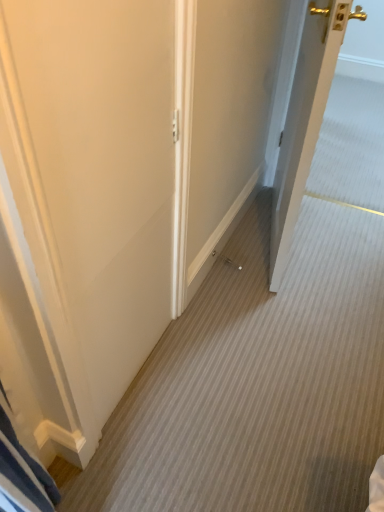
Find the location of a particular element. This screenshot has height=512, width=384. white matte door at center, marked as the second door in a right-to-left arrangement is located at coordinates (84, 204).

The image size is (384, 512). Describe the element at coordinates (84, 204) in the screenshot. I see `white matte door at center, the 1th door when ordered from left to right` at that location.

The width and height of the screenshot is (384, 512). I want to click on white wood door at right, placed as the 2th door when sorted from left to right, so (x=305, y=120).

Describe the element at coordinates (305, 120) in the screenshot. The image size is (384, 512). I see `white wood door at right, placed as the 2th door when sorted from left to right` at that location.

This screenshot has height=512, width=384. Identify the location of white matte door at center, marked as the second door in a right-to-left arrangement. (84, 204).

Can you confirm if white matte door at center, the 1th door when ordered from left to right, is positioned to the right of white wood door at right, placed as the 2th door when sorted from left to right?

No, white matte door at center, the 1th door when ordered from left to right, is not to the right of white wood door at right, placed as the 2th door when sorted from left to right.

Between white matte door at center, the 1th door when ordered from left to right, and white wood door at right, the first door positioned from the right, which one is positioned in front?

white matte door at center, the 1th door when ordered from left to right, is more forward.

Does point (123, 273) appear closer or farther from the camera than point (318, 65)?

Point (123, 273) is closer to the camera than point (318, 65).

From the image's perspective, is white matte door at center, marked as the second door in a right-to-left arrangement, beneath white wood door at right, the first door positioned from the right?

Correct, white matte door at center, marked as the second door in a right-to-left arrangement, appears lower than white wood door at right, the first door positioned from the right, in the image.

From a real-world perspective, is white matte door at center, marked as the second door in a right-to-left arrangement, on top of white wood door at right, the first door positioned from the right?

Indeed, from a real-world perspective, white matte door at center, marked as the second door in a right-to-left arrangement, stands above white wood door at right, the first door positioned from the right.

Consider the image. Is white matte door at center, the 1th door when ordered from left to right, wider than white wood door at right, placed as the 2th door when sorted from left to right?

No.

In the scene shown: Can you confirm if white matte door at center, the 1th door when ordered from left to right, is shorter than white wood door at right, the first door positioned from the right?

In fact, white matte door at center, the 1th door when ordered from left to right, may be taller than white wood door at right, the first door positioned from the right.

Which of these two, white matte door at center, marked as the second door in a right-to-left arrangement, or white wood door at right, the first door positioned from the right, is bigger?

white wood door at right, the first door positioned from the right.

Is white matte door at center, marked as the second door in a right-to-left arrangement, not inside white wood door at right, placed as the 2th door when sorted from left to right?

Yes, white matte door at center, marked as the second door in a right-to-left arrangement, is not within white wood door at right, placed as the 2th door when sorted from left to right.

From the picture: Is white matte door at center, the 1th door when ordered from left to right, positioned with its back to white wood door at right, the first door positioned from the right?

No, white matte door at center, the 1th door when ordered from left to right, is not facing the opposite direction of white wood door at right, the first door positioned from the right.

Where is `door behind the white matte door at center, marked as the second door in a right-to-left arrangement`? door behind the white matte door at center, marked as the second door in a right-to-left arrangement is located at coordinates (305, 120).

Between white wood door at right, the first door positioned from the right, and white matte door at center, marked as the second door in a right-to-left arrangement, which one appears on the right side from the viewer's perspective?

white wood door at right, the first door positioned from the right.

Considering the relative positions of white wood door at right, placed as the 2th door when sorted from left to right, and white matte door at center, marked as the second door in a right-to-left arrangement, in the image provided, is white wood door at right, placed as the 2th door when sorted from left to right, in front of white matte door at center, marked as the second door in a right-to-left arrangement,?

No, it is not.

Which is more distant, (331,6) or (11,379)?

Positioned behind is point (331,6).

From the image's perspective, does white wood door at right, placed as the 2th door when sorted from left to right, appear lower than white matte door at center, the 1th door when ordered from left to right?

No, from the image's perspective, white wood door at right, placed as the 2th door when sorted from left to right, is not beneath white matte door at center, the 1th door when ordered from left to right.

From a real-world perspective, is white wood door at right, placed as the 2th door when sorted from left to right, located higher than white matte door at center, the 1th door when ordered from left to right?

No.

Which of these two, white wood door at right, the first door positioned from the right, or white matte door at center, the 1th door when ordered from left to right, is wider?

With larger width is white wood door at right, the first door positioned from the right.

Considering the relative sizes of white wood door at right, placed as the 2th door when sorted from left to right, and white matte door at center, the 1th door when ordered from left to right, in the image provided, is white wood door at right, placed as the 2th door when sorted from left to right, taller than white matte door at center, the 1th door when ordered from left to right,?

Incorrect, the height of white wood door at right, placed as the 2th door when sorted from left to right, is not larger of that of white matte door at center, the 1th door when ordered from left to right.

Considering the sizes of objects white wood door at right, the first door positioned from the right, and white matte door at center, the 1th door when ordered from left to right, in the image provided, who is bigger, white wood door at right, the first door positioned from the right, or white matte door at center, the 1th door when ordered from left to right,?

Bigger between the two is white wood door at right, the first door positioned from the right.

Is white wood door at right, placed as the 2th door when sorted from left to right, outside of white matte door at center, marked as the second door in a right-to-left arrangement?

That's correct, white wood door at right, placed as the 2th door when sorted from left to right, is outside of white matte door at center, marked as the second door in a right-to-left arrangement.

Are white wood door at right, the first door positioned from the right, and white matte door at center, marked as the second door in a right-to-left arrangement, making contact?

white wood door at right, the first door positioned from the right, and white matte door at center, marked as the second door in a right-to-left arrangement, are not in contact.

Is white wood door at right, the first door positioned from the right, positioned with its back to white matte door at center, the 1th door when ordered from left to right?

No, white wood door at right, the first door positioned from the right, is not facing away from white matte door at center, the 1th door when ordered from left to right.

Can you tell me how much white wood door at right, the first door positioned from the right, and white matte door at center, the 1th door when ordered from left to right, differ in facing direction?

white wood door at right, the first door positioned from the right, and white matte door at center, the 1th door when ordered from left to right, are facing 16.6 degrees away from each other.

How much distance is there between white wood door at right, the first door positioned from the right, and white matte door at center, marked as the second door in a right-to-left arrangement?

A distance of 27.64 inches exists between white wood door at right, the first door positioned from the right, and white matte door at center, marked as the second door in a right-to-left arrangement.

I want to click on door above the white wood door at right, the first door positioned from the right (from a real-world perspective), so click(84, 204).

You are a GUI agent. You are given a task and a screenshot of the screen. Output one action in this format:
    pyautogui.click(x=<x>, y=<y>)
    Task: Click on the door that is under the white matte door at center, the 1th door when ordered from left to right (from a real-world perspective)
    The height and width of the screenshot is (512, 384).
    Given the screenshot: What is the action you would take?
    pyautogui.click(x=305, y=120)

At what (x,y) coordinates should I click in order to perform the action: click on door behind the white matte door at center, the 1th door when ordered from left to right. Please return your answer as a coordinate pair (x, y). The image size is (384, 512). Looking at the image, I should click on (305, 120).